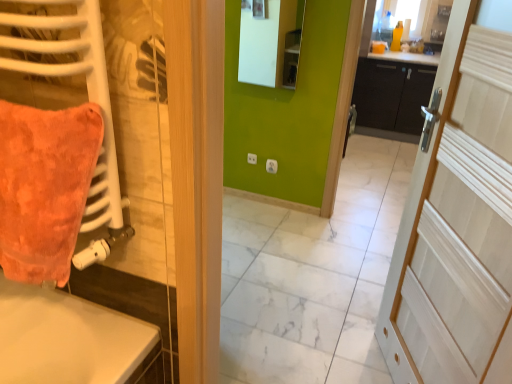
Question: Is orange plush throw pillow at left outside of matte white mirror at upper center?

Choices:
 (A) yes
 (B) no

Answer: (A)

Question: From the image's perspective, is orange plush throw pillow at left located above matte white mirror at upper center?

Choices:
 (A) yes
 (B) no

Answer: (B)

Question: Does orange plush throw pillow at left appear on the left side of matte white mirror at upper center?

Choices:
 (A) no
 (B) yes

Answer: (B)

Question: Can you confirm if orange plush throw pillow at left is thinner than matte white mirror at upper center?

Choices:
 (A) yes
 (B) no

Answer: (B)

Question: Can you confirm if orange plush throw pillow at left is positioned to the right of matte white mirror at upper center?

Choices:
 (A) no
 (B) yes

Answer: (A)

Question: In terms of height, does orange plush throw pillow at left look taller or shorter compared to black matte cabinet at center?

Choices:
 (A) tall
 (B) short

Answer: (B)

Question: Considering the relative positions of orange plush throw pillow at left and black matte cabinet at center in the image provided, is orange plush throw pillow at left to the left or to the right of black matte cabinet at center?

Choices:
 (A) right
 (B) left

Answer: (B)

Question: Is orange plush throw pillow at left in front of or behind black matte cabinet at center in the image?

Choices:
 (A) behind
 (B) front

Answer: (B)

Question: From a real-world perspective, relative to black matte cabinet at center, is orange plush throw pillow at left vertically above or below?

Choices:
 (A) above
 (B) below

Answer: (A)

Question: In terms of size, does matte white mirror at upper center appear bigger or smaller than white wood door at right?

Choices:
 (A) big
 (B) small

Answer: (B)

Question: Relative to white wood door at right, is matte white mirror at upper center in front or behind?

Choices:
 (A) behind
 (B) front

Answer: (A)

Question: From the image's perspective, is matte white mirror at upper center located above or below white wood door at right?

Choices:
 (A) above
 (B) below

Answer: (A)

Question: Is matte white mirror at upper center inside or outside of white wood door at right?

Choices:
 (A) outside
 (B) inside

Answer: (A)

Question: Which is correct: white wood door at right is inside orange plush throw pillow at left, or outside of it?

Choices:
 (A) outside
 (B) inside

Answer: (A)

Question: From the image's perspective, is white wood door at right positioned above or below orange plush throw pillow at left?

Choices:
 (A) above
 (B) below

Answer: (B)